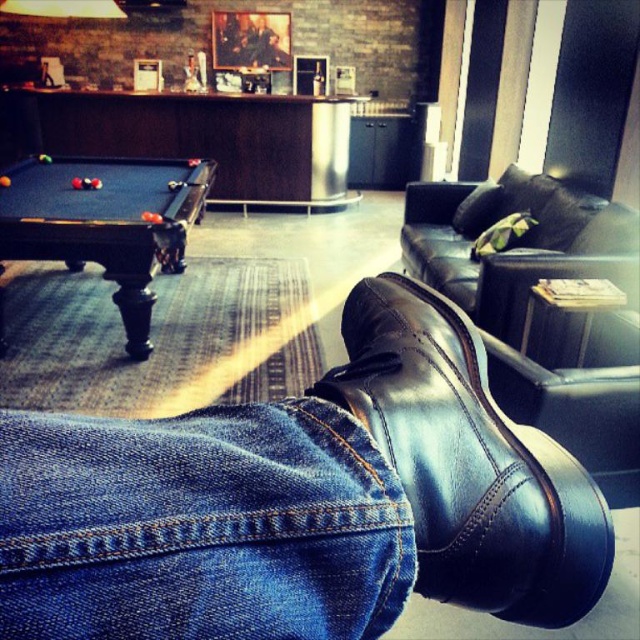
You are standing in the lounge and want to place a rectangular decorative mat that is 1 meter wide between the denim at lower right and the black wooden pool table at left. Can the mat fit horizontally between them?

The denim at lower right has a width less than the black wooden pool table at left. Since the mat is 1 meter wide, we need to know the actual distance between them. However, the description only compares their widths, not the space between them. Therefore, it is impossible to determine if the mat will fit based on the given information.

You are standing in the lounge and want to place a small plant pot on the floor near the denim at lower right. According to the coordinates provided, where should you place the plant pot?

You should place the plant pot near the denim at lower right at point coordinates (200, 525).

You are sitting in the lounge and want to reach a small object located at point [236,604]. There is another object at point [401,326]. Which point is closer to you?

Point [236,604] is closer to you because it is in front of point [401,326].